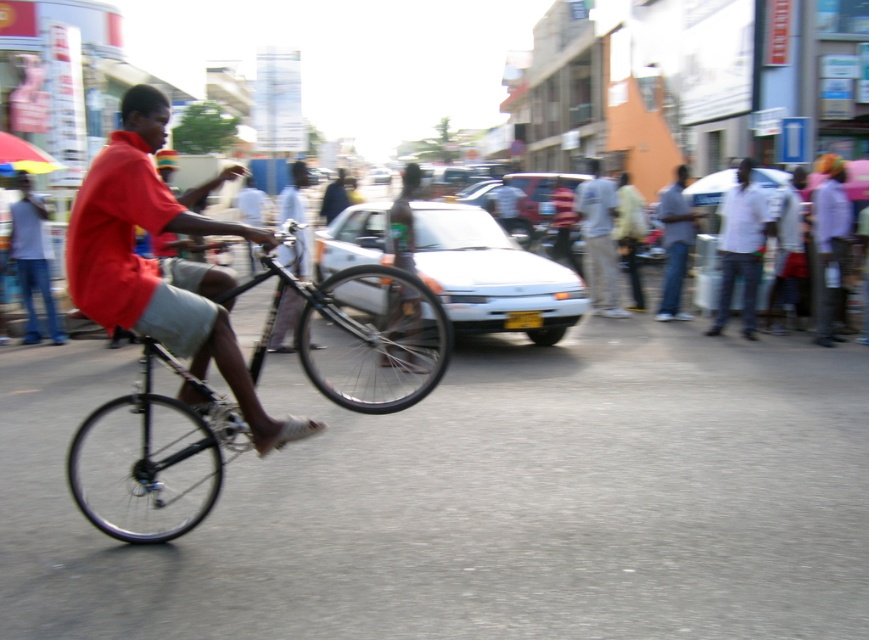
Which is in front, point (123, 508) or point (569, 321)?

Point (123, 508)

Is shiny black bicycle at center behind white glossy car at center?

No, it is in front of white glossy car at center.

Locate an element on the screen. This screenshot has width=869, height=640. shiny black bicycle at center is located at coordinates (151, 458).

Where is `shiny black bicycle at center`? The width and height of the screenshot is (869, 640). shiny black bicycle at center is located at coordinates (151, 458).

Where is `white matte shirt at right`? The width and height of the screenshot is (869, 640). white matte shirt at right is located at coordinates (740, 248).

Which is in front, point (735, 176) or point (673, 253)?

Positioned in front is point (735, 176).

Describe the element at coordinates (740, 248) in the screenshot. I see `white matte shirt at right` at that location.

You are a GUI agent. You are given a task and a screenshot of the screen. Output one action in this format:
    pyautogui.click(x=<x>, y=<y>)
    Task: Click on the white matte shirt at right
    The height and width of the screenshot is (640, 869).
    Given the screenshot: What is the action you would take?
    pyautogui.click(x=740, y=248)

Does white glossy car at center appear under light gray cotton pants at center?

Indeed, white glossy car at center is positioned under light gray cotton pants at center.

The image size is (869, 640). What are the coordinates of `white glossy car at center` in the screenshot? It's located at (491, 275).